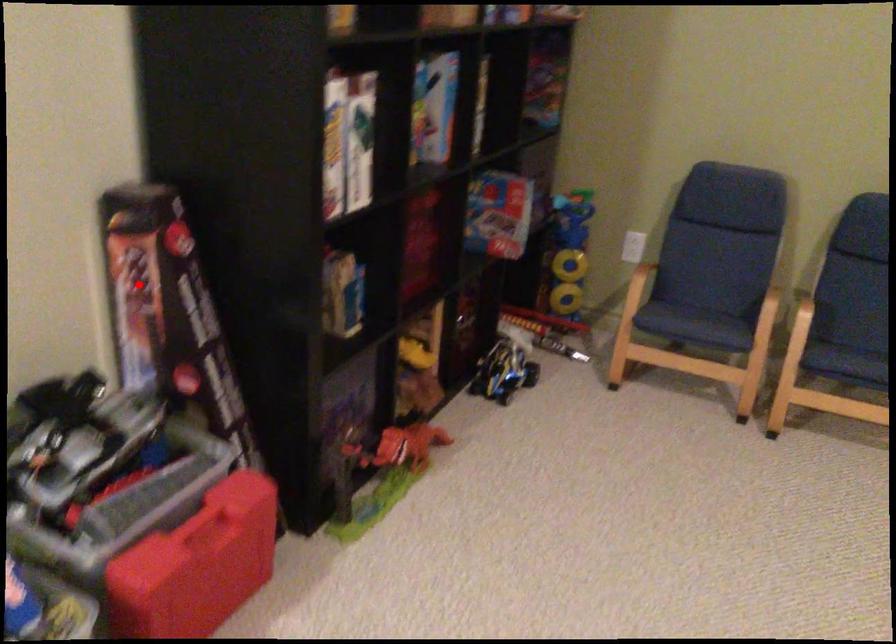
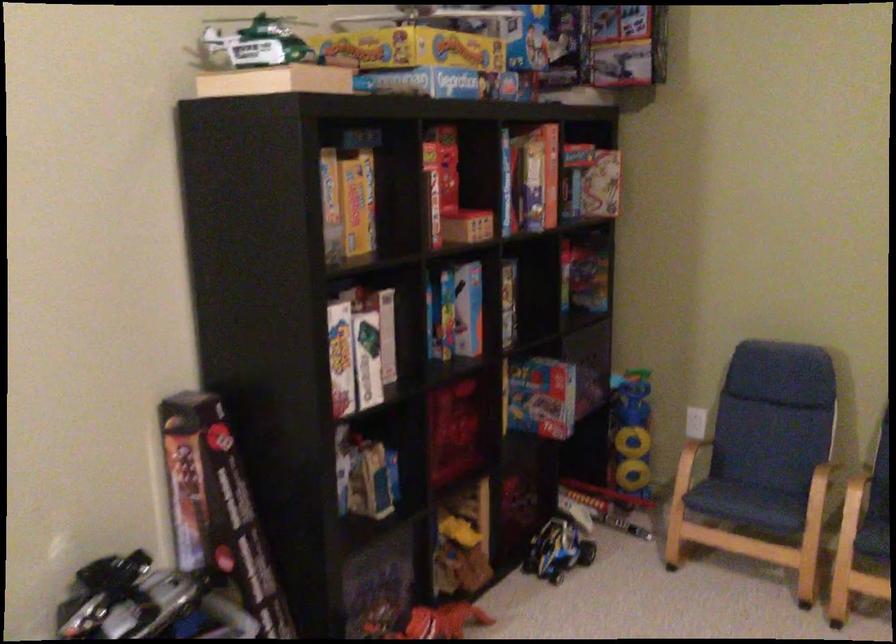
Question: I am providing you with two images of the same scene from different viewpoints. A red point is shown in image1. For the corresponding object point in image2, is it positioned nearer or farther from the camera?

Choices:
 (A) Nearer
 (B) Farther

Answer: (B)